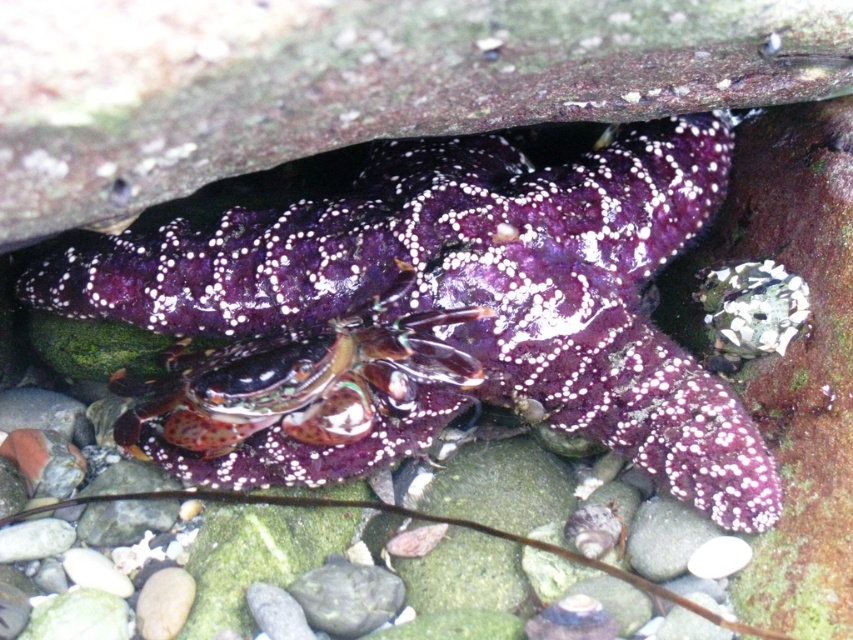
From the picture: You are a marine biologist observing the image. You need to determine if the purple glossy starfish at center can fully cover the shiny purple hermit crab at center when placed side by side. Based on their sizes, what do you conclude?

The purple glossy starfish at center is wider than the shiny purple hermit crab at center, so it can fully cover the hermit crab when placed side by side.

In the scene shown: You are a marine biologist observing the scene. You notice the purple glossy starfish at center and the shiny purple hermit crab at center. Which one is positioned more to the right side of the image?

The purple glossy starfish at center is positioned more to the right side of the image than the shiny purple hermit crab at center.

In the scene shown: You are a geologist examining the rocky surface where the starfish is located. You notice two points marked on the image at coordinates point (315,282) and point (364,378). From your current viewpoint, which point is closer to you?

Point (364,378) is closer to you because point (315,282) is behind it.